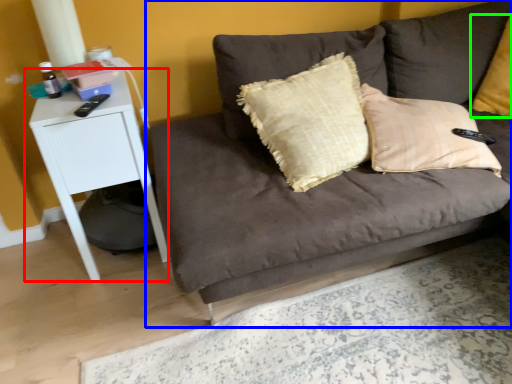
Question: Considering the real-world distances, which object is closest to table (highlighted by a red box)? studio couch (highlighted by a blue box) or pillow (highlighted by a green box).

Choices:
 (A) studio couch
 (B) pillow

Answer: (A)